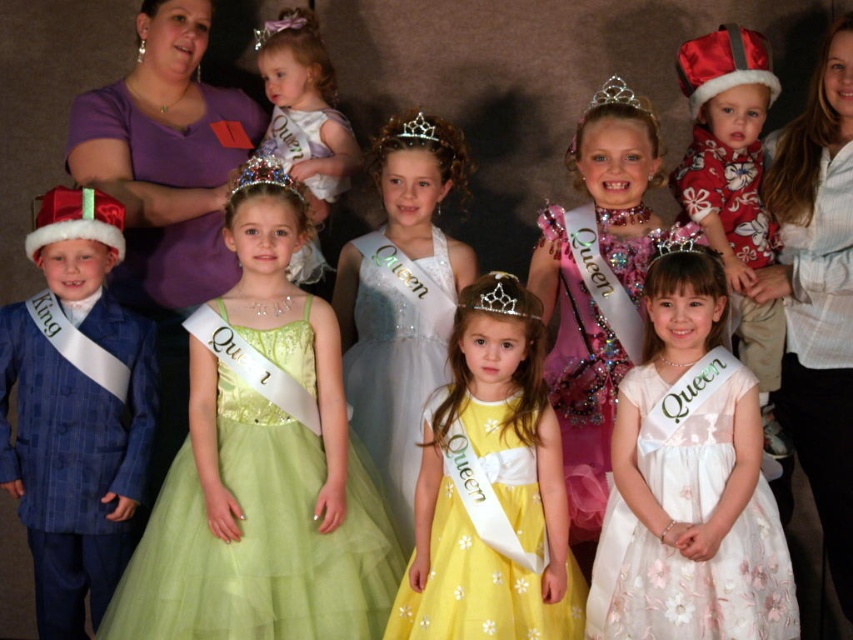
Can you confirm if blue plaid suit at left is shorter than matte red dress at center?

Incorrect, blue plaid suit at left's height does not fall short of matte red dress at center's.

Where is `blue plaid suit at left`? The image size is (853, 640). blue plaid suit at left is located at coordinates (74, 410).

At what (x,y) coordinates should I click in order to perform the action: click on blue plaid suit at left. Please return your answer as a coordinate pair (x, y). Looking at the image, I should click on (74, 410).

Is the position of matte red dress at center less distant than that of sparkly silver crown at center?

No.

Is point (741, 291) farther from viewer compared to point (294, 193)?

Yes.

Find the location of a particular element. matte red dress at center is located at coordinates (734, 188).

Based on the photo, which of these two, matte white dress at center or purple satin tiara at upper center, stands shorter?

purple satin tiara at upper center is shorter.

Is point (280, 58) in front of point (259, 29)?

Yes, it is.

Locate an element on the screen. matte white dress at center is located at coordinates (303, 106).